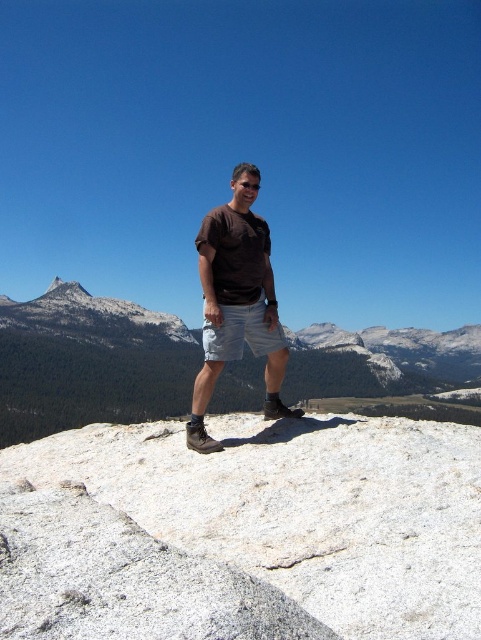
Can you confirm if white granite rock at center is thinner than gray/granite mountain at center?

Yes, white granite rock at center is thinner than gray/granite mountain at center.

Does white granite rock at center appear on the left side of gray/granite mountain at center?

Correct, you'll find white granite rock at center to the left of gray/granite mountain at center.

Where is `white granite rock at center`? This screenshot has width=481, height=640. white granite rock at center is located at coordinates (243, 531).

You are a GUI agent. You are given a task and a screenshot of the screen. Output one action in this format:
    pyautogui.click(x=<x>, y=<y>)
    Task: Click on the white granite rock at center
    Image resolution: width=481 pixels, height=640 pixels.
    Given the screenshot: What is the action you would take?
    pyautogui.click(x=243, y=531)

Can you confirm if white granite rock at center is positioned below gray/granite peak at upper left?

Correct, white granite rock at center is located below gray/granite peak at upper left.

Looking at this image, is white granite rock at center to the right of gray/granite peak at upper left from the viewer's perspective?

Correct, you'll find white granite rock at center to the right of gray/granite peak at upper left.

What are the coordinates of `white granite rock at center` in the screenshot? It's located at (243, 531).

Does gray/granite mountain at center appear on the left side of black matte goggles at center?

In fact, gray/granite mountain at center is to the right of black matte goggles at center.

Is gray/granite mountain at center bigger than black matte goggles at center?

Yes, gray/granite mountain at center is bigger than black matte goggles at center.

The image size is (481, 640). Find the location of `gray/granite mountain at center`. gray/granite mountain at center is located at coordinates (89, 364).